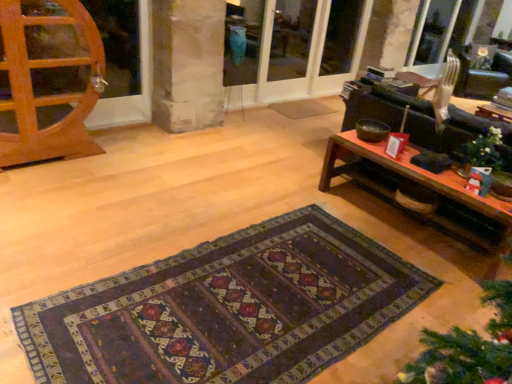
This screenshot has height=384, width=512. In order to click on transparent glass screen door at upper center, the 3th screen door positioned from the right in this screenshot , I will do `click(288, 46)`.

The width and height of the screenshot is (512, 384). What do you see at coordinates (340, 44) in the screenshot?
I see `transparent glass screen door at upper center, marked as the first screen door in a right-to-left arrangement` at bounding box center [340, 44].

This screenshot has height=384, width=512. What do you see at coordinates (477, 80) in the screenshot?
I see `metallic silver armchair at upper right` at bounding box center [477, 80].

What do you see at coordinates (412, 176) in the screenshot?
I see `wooden coffee table at right` at bounding box center [412, 176].

Image resolution: width=512 pixels, height=384 pixels. I want to click on transparent glass screen door at upper center, the 3th screen door positioned from the right, so click(x=288, y=46).

Is dark woven rug at center not close to white matte christmas ornament at right?

Indeed, dark woven rug at center is not near white matte christmas ornament at right.

Identify the location of mat in front of the white matte christmas ornament at right. (227, 309).

Which point is more distant from viewer, (x=311, y=319) or (x=456, y=154)?

The point (x=456, y=154) is behind.

From the image's perspective, is dark woven rug at center located above white matte christmas ornament at right?

Actually, dark woven rug at center appears below white matte christmas ornament at right in the image.

From the image's perspective, is white matte christmas ornament at right beneath matte glass screen door at center, marked as the 2th screen door in a right-to-left arrangement?

Indeed, from the image's perspective, white matte christmas ornament at right is shown beneath matte glass screen door at center, marked as the 2th screen door in a right-to-left arrangement.

From a real-world perspective, which object rests below the other?

From a 3D spatial view, white matte christmas ornament at right is below.

Considering the sizes of objects white matte christmas ornament at right and matte glass screen door at center, marked as the 2th screen door in a right-to-left arrangement, in the image provided, who is shorter, white matte christmas ornament at right or matte glass screen door at center, marked as the 2th screen door in a right-to-left arrangement,?

white matte christmas ornament at right is shorter.

Looking at the image, does wooden coffee table at right seem bigger or smaller compared to transparent glass screen door at upper center, the 3th screen door positioned from the right?

Clearly, wooden coffee table at right is larger in size than transparent glass screen door at upper center, the 3th screen door positioned from the right.

Are wooden coffee table at right and transparent glass screen door at upper center, acting as the first screen door starting from the left, making contact?

wooden coffee table at right and transparent glass screen door at upper center, acting as the first screen door starting from the left, are not in contact.

From a real-world perspective, is wooden coffee table at right positioned above or below transparent glass screen door at upper center, acting as the first screen door starting from the left?

Clearly, from a real-world perspective, wooden coffee table at right is below transparent glass screen door at upper center, acting as the first screen door starting from the left.

Is matte glass screen door at center, the second screen door in the left-to-right sequence, facing away from transparent glass screen door at upper center, the 3th screen door positioned from the left?

Yes, transparent glass screen door at upper center, the 3th screen door positioned from the left, is at the back of matte glass screen door at center, the second screen door in the left-to-right sequence.

Between point (234, 82) and point (338, 26), which one is positioned behind?

The point (338, 26) is farther from the camera.

Is matte glass screen door at center, marked as the 2th screen door in a right-to-left arrangement, inside or outside of transparent glass screen door at upper center, the 3th screen door positioned from the left?

matte glass screen door at center, marked as the 2th screen door in a right-to-left arrangement, is located beyond the bounds of transparent glass screen door at upper center, the 3th screen door positioned from the left.

Locate an element on the screen. the 1st screen door located beneath the transparent glass screen door at upper center, marked as the first screen door in a right-to-left arrangement (from a real-world perspective) is located at coordinates (292, 49).

From the image's perspective, between metallic silver armchair at upper right and wooden coffee table at right, which one is located above?

metallic silver armchair at upper right appears higher in the image.

Is metallic silver armchair at upper right to the left or to the right of wooden coffee table at right in the image?

metallic silver armchair at upper right is to the right of wooden coffee table at right.

Does metallic silver armchair at upper right have a greater width compared to wooden coffee table at right?

Indeed, metallic silver armchair at upper right has a greater width compared to wooden coffee table at right.

Is wooden coffee table at right completely or partially inside metallic silver armchair at upper right?

No, metallic silver armchair at upper right does not contain wooden coffee table at right.

Is transparent glass screen door at upper center, marked as the first screen door in a right-to-left arrangement, shorter than matte glass screen door at center, the second screen door in the left-to-right sequence?

Yes.

From the image's perspective, is transparent glass screen door at upper center, marked as the first screen door in a right-to-left arrangement, positioned above or below matte glass screen door at center, marked as the 2th screen door in a right-to-left arrangement?

Clearly, from the image's perspective, transparent glass screen door at upper center, marked as the first screen door in a right-to-left arrangement, is above matte glass screen door at center, marked as the 2th screen door in a right-to-left arrangement.

Is transparent glass screen door at upper center, the 3th screen door positioned from the left, positioned with its back to matte glass screen door at center, marked as the 2th screen door in a right-to-left arrangement?

Absolutely, transparent glass screen door at upper center, the 3th screen door positioned from the left, is directed away from matte glass screen door at center, marked as the 2th screen door in a right-to-left arrangement.

Which object is thinner, transparent glass screen door at upper center, marked as the first screen door in a right-to-left arrangement, or matte glass screen door at center, marked as the 2th screen door in a right-to-left arrangement?

Thinner between the two is transparent glass screen door at upper center, marked as the first screen door in a right-to-left arrangement.

From a real-world perspective, between matte glass screen door at center, the second screen door in the left-to-right sequence, and dark woven rug at center, who is vertically higher?

matte glass screen door at center, the second screen door in the left-to-right sequence, from a real-world perspective.

In terms of size, does matte glass screen door at center, the second screen door in the left-to-right sequence, appear bigger or smaller than dark woven rug at center?

In the image, matte glass screen door at center, the second screen door in the left-to-right sequence, appears to be larger than dark woven rug at center.

From the image's perspective, which object appears higher, matte glass screen door at center, marked as the 2th screen door in a right-to-left arrangement, or dark woven rug at center?

From the image's view, matte glass screen door at center, marked as the 2th screen door in a right-to-left arrangement, is above.

Is matte glass screen door at center, the second screen door in the left-to-right sequence, touching dark woven rug at center?

There is a gap between matte glass screen door at center, the second screen door in the left-to-right sequence, and dark woven rug at center.

Identify the location of christmas decoration above the dark woven rug at center (from a real-world perspective). This screenshot has width=512, height=384. (481, 152).

Locate an element on the screen. The width and height of the screenshot is (512, 384). screen door that is the 2nd one when counting upward from the white matte christmas ornament at right (from the image's perspective) is located at coordinates (292, 49).

Based on their spatial positions, is dark woven rug at center or matte glass screen door at center, marked as the 2th screen door in a right-to-left arrangement, further from white matte christmas ornament at right?

Based on the image, matte glass screen door at center, marked as the 2th screen door in a right-to-left arrangement, appears to be further to white matte christmas ornament at right.

When comparing their distances from metallic silver armchair at upper right, does white matte christmas ornament at right or matte glass screen door at center, the second screen door in the left-to-right sequence, seem further?

Among the two, white matte christmas ornament at right is located further to metallic silver armchair at upper right.

Which object lies nearer to the anchor point dark woven rug at center, wooden coffee table at right or transparent glass screen door at upper center, the 3th screen door positioned from the right?

wooden coffee table at right is closer to dark woven rug at center.

Estimate the real-world distances between objects in this image. Which object is closer to white matte christmas ornament at right, transparent glass screen door at upper center, the 3th screen door positioned from the left, or metallic silver armchair at upper right?

metallic silver armchair at upper right is positioned closer to the anchor white matte christmas ornament at right.

Which object lies nearer to the anchor point dark woven rug at center, matte glass screen door at center, marked as the 2th screen door in a right-to-left arrangement, or transparent glass screen door at upper center, marked as the first screen door in a right-to-left arrangement?

matte glass screen door at center, marked as the 2th screen door in a right-to-left arrangement.

When comparing their distances from metallic silver armchair at upper right, does transparent glass screen door at upper center, acting as the first screen door starting from the left, or white matte christmas ornament at right seem closer?

transparent glass screen door at upper center, acting as the first screen door starting from the left.

Consider the image. Which object lies further to the anchor point wooden coffee table at right, transparent glass screen door at upper center, the 3th screen door positioned from the right, or matte glass screen door at center, the second screen door in the left-to-right sequence?

Based on the image, transparent glass screen door at upper center, the 3th screen door positioned from the right, appears to be further to wooden coffee table at right.

Based on their spatial positions, is dark woven rug at center or metallic silver armchair at upper right further from transparent glass screen door at upper center, acting as the first screen door starting from the left?

Among the two, dark woven rug at center is located further to transparent glass screen door at upper center, acting as the first screen door starting from the left.

The width and height of the screenshot is (512, 384). Find the location of `table between dark woven rug at center and matte glass screen door at center, marked as the 2th screen door in a right-to-left arrangement, along the z-axis`. table between dark woven rug at center and matte glass screen door at center, marked as the 2th screen door in a right-to-left arrangement, along the z-axis is located at coordinates (412, 176).

Identify the location of screen door positioned between white matte christmas ornament at right and transparent glass screen door at upper center, acting as the first screen door starting from the left, from near to far. (292, 49).

Image resolution: width=512 pixels, height=384 pixels. In order to click on table between dark woven rug at center and transparent glass screen door at upper center, the 3th screen door positioned from the left, from front to back in this screenshot , I will do `click(412, 176)`.

Identify the location of screen door between matte glass screen door at center, marked as the 2th screen door in a right-to-left arrangement, and transparent glass screen door at upper center, the 3th screen door positioned from the left, from front to back. (288, 46).